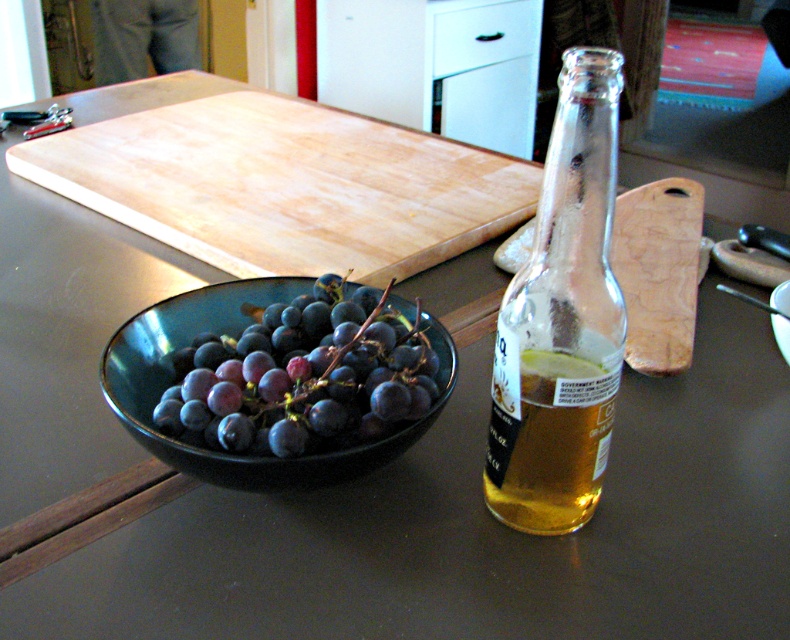
Question: Is clear glass bottle at center below translucent glass beer at right?

Choices:
 (A) no
 (B) yes

Answer: (A)

Question: Estimate the real-world distances between objects in this image. Which object is farther from the wooden cutting board at center?

Choices:
 (A) glossy ceramic bowl at lower left
 (B) translucent glass beer at right
 (C) clear glass bottle at center
 (D) wooden cutting board at right

Answer: (B)

Question: Which of the following is the closest to the observer?

Choices:
 (A) wooden cutting board at right
 (B) wooden cutting board at center

Answer: (A)

Question: Does glossy ceramic bowl at lower left come behind wooden cutting board at right?

Choices:
 (A) no
 (B) yes

Answer: (A)

Question: Which is nearer to the glossy ceramic bowl at lower left?

Choices:
 (A) wooden cutting board at right
 (B) wooden cutting board at center
 (C) translucent glass beer at right
 (D) clear glass bottle at center

Answer: (D)

Question: Does translucent glass beer at right come in front of wooden cutting board at right?

Choices:
 (A) yes
 (B) no

Answer: (A)